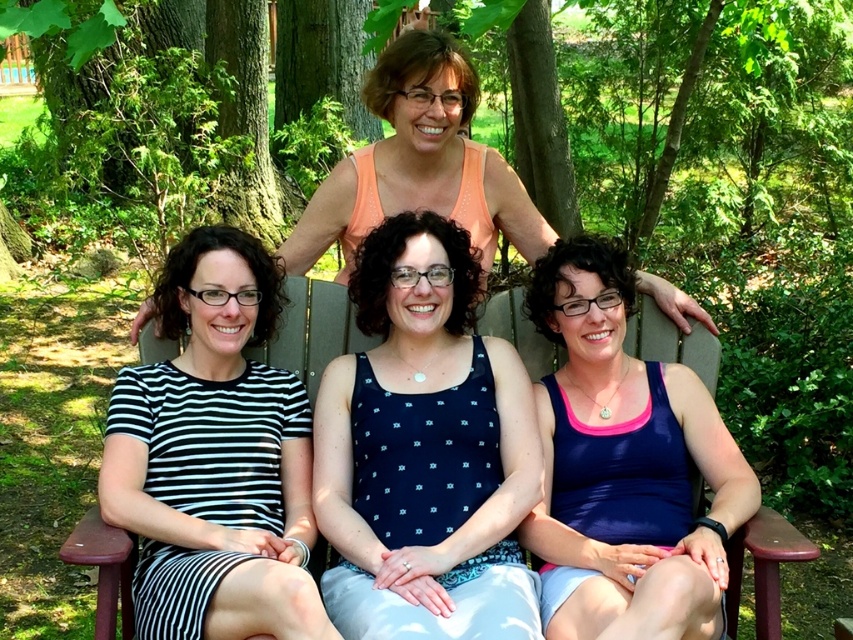
Question: Which point is closer to the camera?

Choices:
 (A) tap(368, 228)
 (B) tap(619, 477)
 (C) tap(276, 444)
 (D) tap(651, 305)

Answer: (B)

Question: Which point appears farthest from the camera in this image?

Choices:
 (A) (747, 509)
 (B) (318, 298)

Answer: (B)

Question: Among these points, which one is nearest to the camera?

Choices:
 (A) (392, 64)
 (B) (583, 570)
 (C) (125, 605)

Answer: (B)

Question: Does black striped dress at left have a greater width compared to blue fabric tank top at lower right?

Choices:
 (A) yes
 (B) no

Answer: (A)

Question: Is orange tank top at upper center bigger than wooden park bench at center?

Choices:
 (A) no
 (B) yes

Answer: (B)

Question: Is orange tank top at upper center above wooden park bench at center?

Choices:
 (A) no
 (B) yes

Answer: (B)